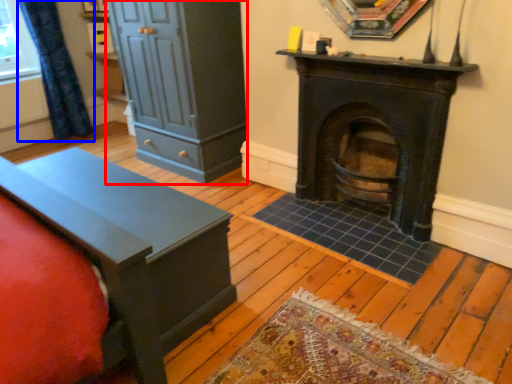
Question: Which object is closer to the camera taking this photo, dresser (highlighted by a red box) or curtain (highlighted by a blue box)?

Choices:
 (A) dresser
 (B) curtain

Answer: (A)